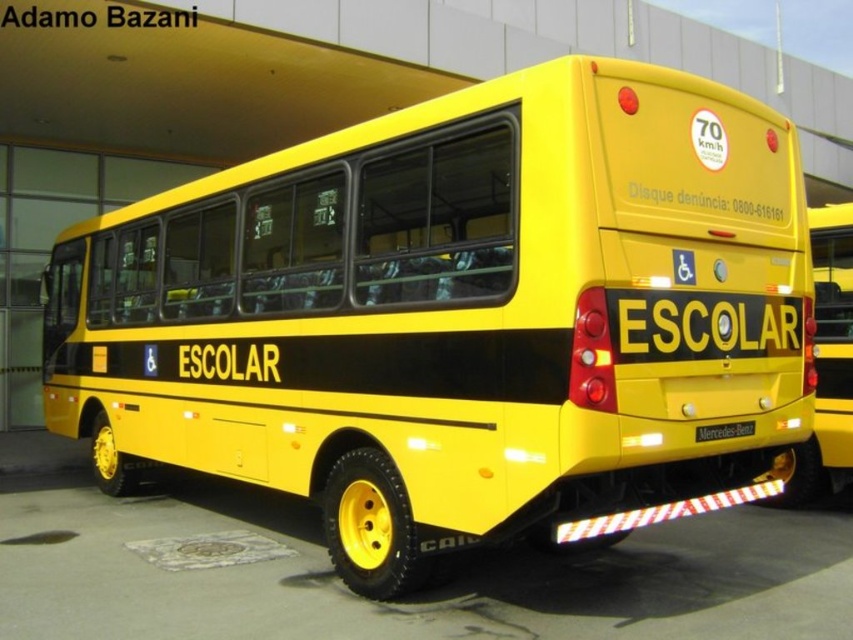
Is yellow matte bus at right to the right of yellow matte license plate at rear from the viewer's perspective?

Yes, yellow matte bus at right is to the right of yellow matte license plate at rear.

Is point (822, 365) more distant than point (718, 428)?

Yes, point (822, 365) is farther from viewer.

In order to click on yellow matte bus at right in this screenshot , I will do `click(833, 342)`.